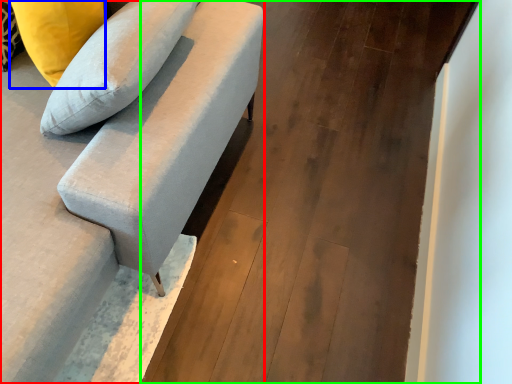
Question: Estimate the real-world distances between objects in this image. Which object is farther from studio couch (highlighted by a red box), pillow (highlighted by a blue box) or concrete (highlighted by a green box)?

Choices:
 (A) pillow
 (B) concrete

Answer: (B)